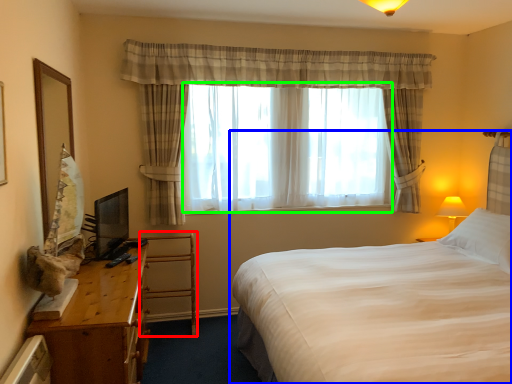
Question: Which is nearer to the armchair (highlighted by a red box)? bed (highlighted by a blue box) or bay window (highlighted by a green box).

Choices:
 (A) bed
 (B) bay window

Answer: (B)